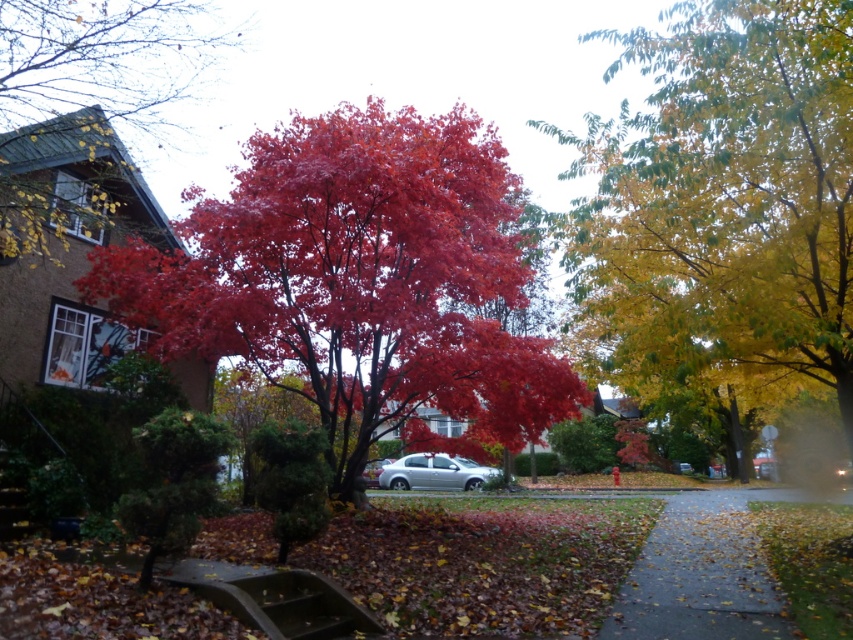
Question: Can you confirm if shiny red maple tree at left is positioned above silver metallic car at center?

Choices:
 (A) yes
 (B) no

Answer: (A)

Question: Among these points, which one is farthest from the camera?

Choices:
 (A) [759, 570]
 (B) [294, 182]
 (C) [120, 8]
 (D) [437, 474]

Answer: (D)

Question: Can you confirm if yellow-green leafy tree at right is wider than gray asphalt sidewalk at lower right?

Choices:
 (A) yes
 (B) no

Answer: (B)

Question: Which object is farther from the camera taking this photo?

Choices:
 (A) gray asphalt sidewalk at lower right
 (B) shiny red maple tree at left
 (C) silver metallic car at center

Answer: (C)

Question: Which point appears closest to the camera in this image?

Choices:
 (A) [x=20, y=99]
 (B) [x=637, y=579]
 (C) [x=805, y=195]
 (D) [x=436, y=477]

Answer: (C)

Question: Does yellow-green leafy tree at right have a larger size compared to gray asphalt sidewalk at lower right?

Choices:
 (A) no
 (B) yes

Answer: (A)